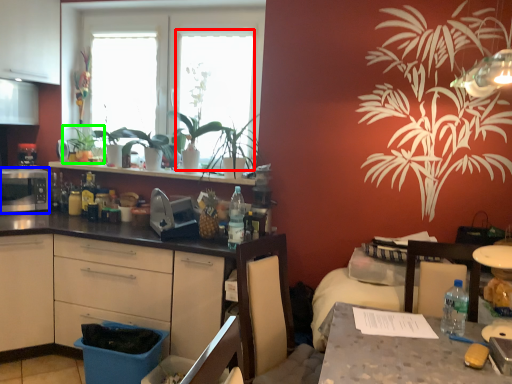
Question: Which object is the farthest from window screen (highlighted by a red box)? Choose among these: appliance (highlighted by a blue box) or houseplant (highlighted by a green box).

Choices:
 (A) appliance
 (B) houseplant

Answer: (A)